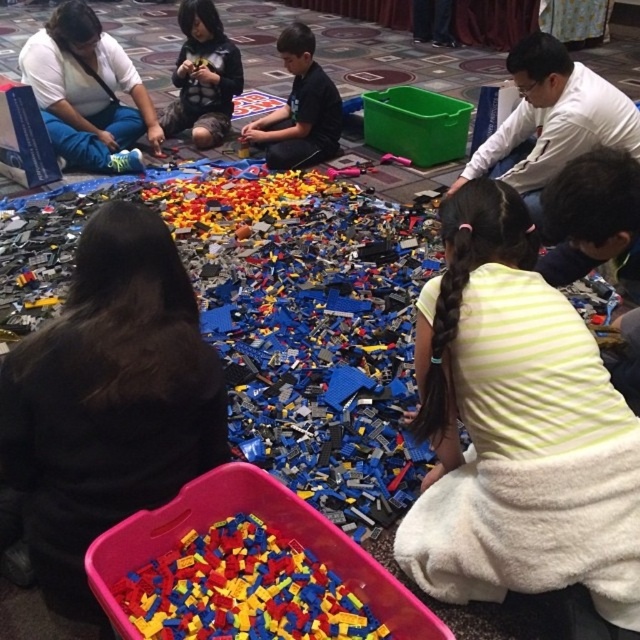
Question: Which of the following is the closest to the observer?

Choices:
 (A) (182, 588)
 (B) (576, 99)
 (C) (250, 122)
 (D) (196, 22)

Answer: (A)

Question: Is brick-like plastic toys at lower center in front of smooth black shirt at center?

Choices:
 (A) yes
 (B) no

Answer: (A)

Question: Can you confirm if brick-like plastic toys at lower center is positioned above matte black shirt at upper center?

Choices:
 (A) yes
 (B) no

Answer: (B)

Question: Which object is closer to the camera taking this photo?

Choices:
 (A) brick-like plastic toys at lower center
 (B) smooth black shirt at center
 (C) white matte shirt at upper right

Answer: (A)

Question: Which object is positioned farthest from the brick-like plastic toys at lower center?

Choices:
 (A) white matte shirt at upper right
 (B) smooth black shirt at center
 (C) matte white shirt at upper left
 (D) matte black shirt at upper center

Answer: (D)

Question: Can you confirm if white matte shirt at upper right is positioned above matte black shirt at upper center?

Choices:
 (A) no
 (B) yes

Answer: (A)